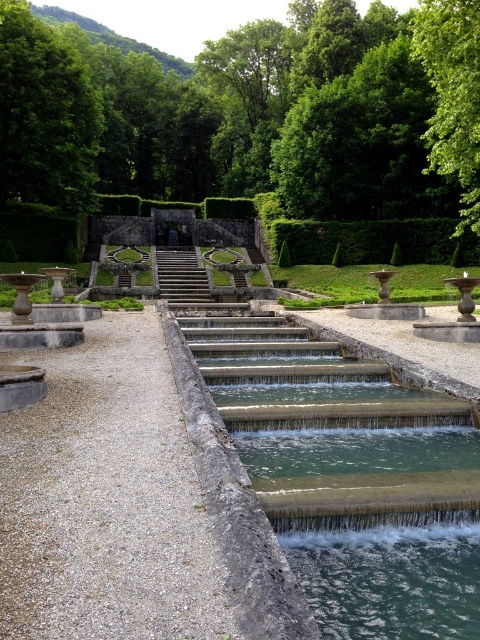
Can you confirm if clear stone water at center is positioned to the right of green leafy tree at upper right?

In fact, clear stone water at center is to the left of green leafy tree at upper right.

The image size is (480, 640). Identify the location of clear stone water at center. (351, 477).

This screenshot has width=480, height=640. I want to click on clear stone water at center, so click(351, 477).

Where is `green leafy tree at upper left`? The height and width of the screenshot is (640, 480). green leafy tree at upper left is located at coordinates (45, 115).

Who is more forward, (74, 193) or (420, 241)?

Point (74, 193) is more forward.

Between point (11, 172) and point (391, 253), which one is positioned in front?

Point (11, 172) is in front.

Where is `green leafy tree at upper left`? green leafy tree at upper left is located at coordinates (45, 115).

Is point (397, 179) closer to viewer compared to point (175, 252)?

Yes.

Which is behind, point (322, 166) or point (189, 256)?

The point (322, 166) is behind.

Does point (342, 77) come closer to viewer compared to point (186, 257)?

No, (342, 77) is behind (186, 257).

This screenshot has height=640, width=480. In order to click on green leafy tree at upper center in this screenshot , I will do `click(362, 145)`.